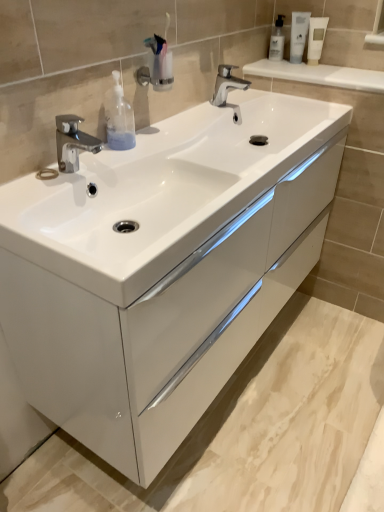
The width and height of the screenshot is (384, 512). What are the coordinates of `vacant area that is in front of white matte tube at upper right, positioned as the 3th mouthwash in left-to-right order` in the screenshot? It's located at (325, 76).